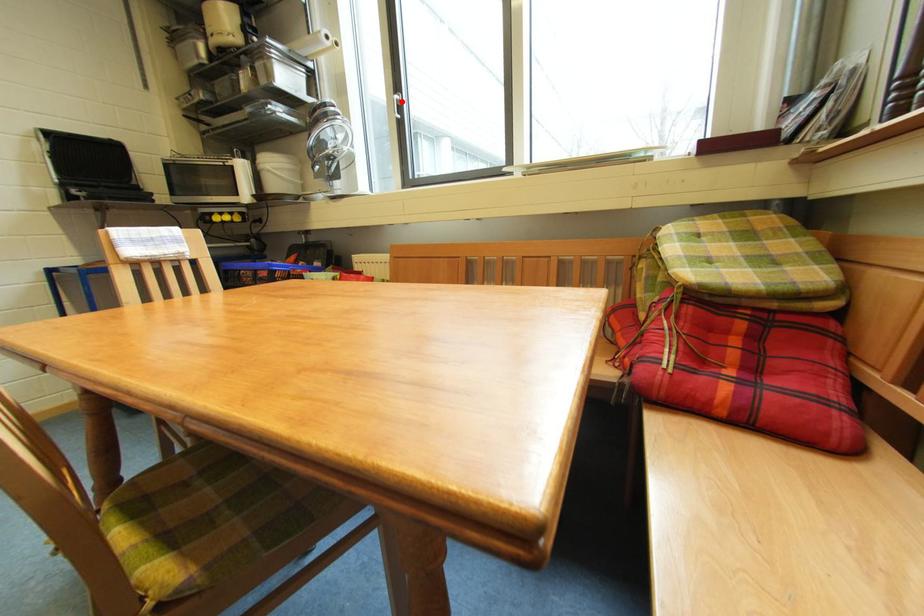
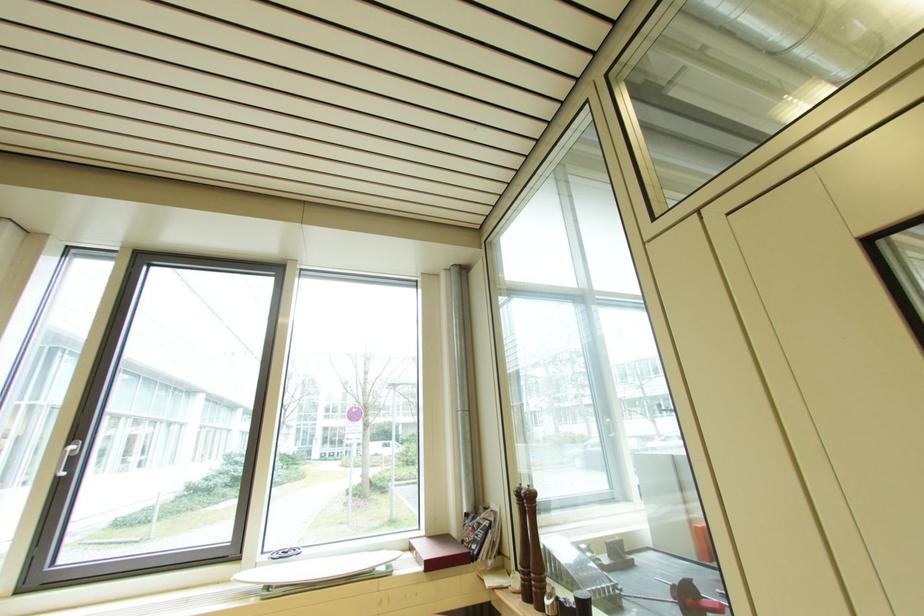
Find the pixel in the second image that matches the highlighted location in the first image.

(73, 455)